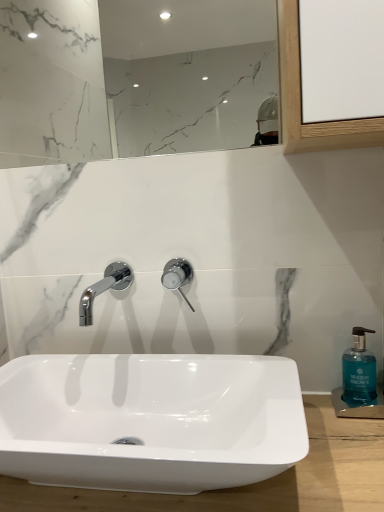
Question: Choose the correct answer: Is polished chrome tap at center inside white glossy sink at center or outside it?

Choices:
 (A) inside
 (B) outside

Answer: (B)

Question: From the image's perspective, relative to white glossy sink at center, is polished chrome tap at center above or below?

Choices:
 (A) below
 (B) above

Answer: (B)

Question: Estimate the real-world distances between objects in this image. Which object is farther from the white marble mirror at upper center?

Choices:
 (A) polished chrome tap at center
 (B) white glossy sink at center
 (C) teal glass soap dispenser at right

Answer: (B)

Question: Which object is the farthest from the white marble mirror at upper center?

Choices:
 (A) polished chrome tap at center
 (B) teal glass soap dispenser at right
 (C) white glossy sink at center

Answer: (C)